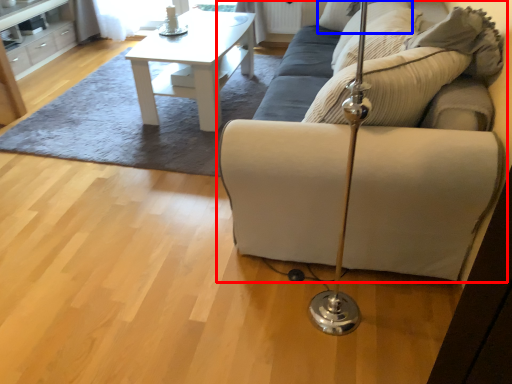
Question: Which object is further to the camera taking this photo, studio couch (highlighted by a red box) or pillow (highlighted by a blue box)?

Choices:
 (A) studio couch
 (B) pillow

Answer: (B)